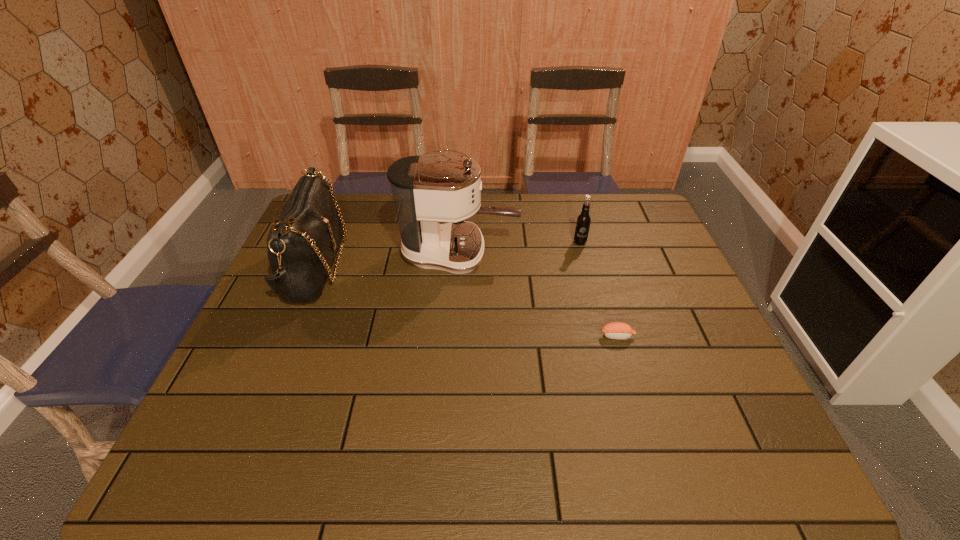
I want to click on vacant area between the nearest object and the root beer, so click(x=599, y=289).

This screenshot has height=540, width=960. I want to click on free space between the third tallest object and the second object from left to right, so click(519, 248).

Find the location of a particular element. free point between the root beer and the tallest object is located at coordinates (519, 248).

Find the location of a particular element. The image size is (960, 540). vacant space that is in between the sushi and the second shortest object is located at coordinates tap(599, 289).

Where is `free space between the nearest object and the coffee maker`? This screenshot has width=960, height=540. free space between the nearest object and the coffee maker is located at coordinates (539, 294).

Where is `free space between the third object from right to left and the leftmost object`? This screenshot has width=960, height=540. free space between the third object from right to left and the leftmost object is located at coordinates (387, 260).

At what (x,y) coordinates should I click in order to perform the action: click on vacant space that's between the third shortest object and the tallest object. Please return your answer as a coordinate pair (x, y). This screenshot has width=960, height=540. Looking at the image, I should click on (387, 260).

Locate an element on the screen. The height and width of the screenshot is (540, 960). object that stands as the third closest to the handbag is located at coordinates (616, 330).

Locate which object ranks second in proximity to the root beer. Please provide its 2D coordinates. Your answer should be formatted as a tuple, i.e. [(x, y)], where the tuple contains the x and y coordinates of a point satisfying the conditions above.

[(616, 330)]

Identify the location of vacant position in the image that satisfies the following two spatial constraints: 1. on the label of the third tallest object; 2. at the front of the third shortest object with chain and zipper. The height and width of the screenshot is (540, 960). (587, 267).